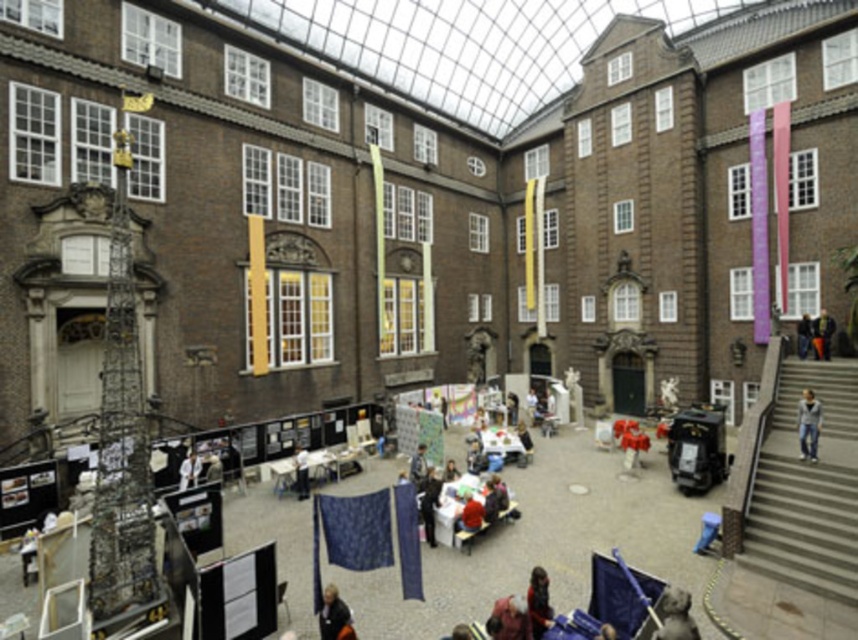
Question: Which of the following is the farthest from the observer?

Choices:
 (A) (645, 440)
 (B) (535, 580)

Answer: (A)

Question: Which object appears farthest from the camera in this image?

Choices:
 (A) fluffy red sweater at center
 (B) dark blue jeans at lower right
 (C) white fabric at lower center

Answer: (B)

Question: From the image, what is the correct spatial relationship of gray stone statue at center in relation to gray cotton jacket at lower right?

Choices:
 (A) below
 (B) above

Answer: (A)

Question: Estimate the real-world distances between objects in this image. Which object is closer to the white fabric at lower left?

Choices:
 (A) dark brown leather jacket at lower center
 (B) gray cotton jacket at lower right
 (C) dark blue fabric at center

Answer: (C)

Question: Can you confirm if dark blue fabric at center is positioned to the right of light brown hair at lower center?

Choices:
 (A) yes
 (B) no

Answer: (B)

Question: Is white fabric at lower center closer to the viewer compared to white fabric at lower left?

Choices:
 (A) yes
 (B) no

Answer: (A)